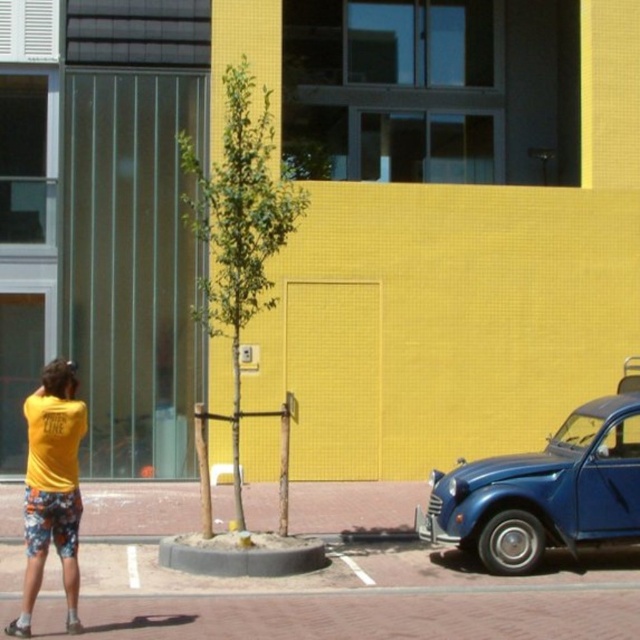
Is yellow matte shorts at lower left further to camera compared to floral cotton shorts at lower left?

No.

From the picture: Which of these two, yellow matte shorts at lower left or floral cotton shorts at lower left, stands taller?

yellow matte shorts at lower left

Does point (81, 401) come farther from viewer compared to point (77, 513)?

That is True.

The width and height of the screenshot is (640, 640). Find the location of `yellow matte shorts at lower left`. yellow matte shorts at lower left is located at coordinates (51, 488).

Who is shorter, glossy blue car at right or floral cotton shorts at lower left?

floral cotton shorts at lower left is shorter.

Who is more forward, (442,525) or (72,536)?

Point (72,536) is more forward.

Where is `glossy blue car at right`? The height and width of the screenshot is (640, 640). glossy blue car at right is located at coordinates (547, 488).

Is glossy blue car at right above yellow matte shorts at lower left?

Incorrect, glossy blue car at right is not positioned above yellow matte shorts at lower left.

In the scene shown: Who is taller, glossy blue car at right or yellow matte shorts at lower left?

yellow matte shorts at lower left

Between point (563, 465) and point (74, 410), which one is positioned in front?

Point (74, 410) is in front.

Locate an element on the screen. The image size is (640, 640). glossy blue car at right is located at coordinates (547, 488).